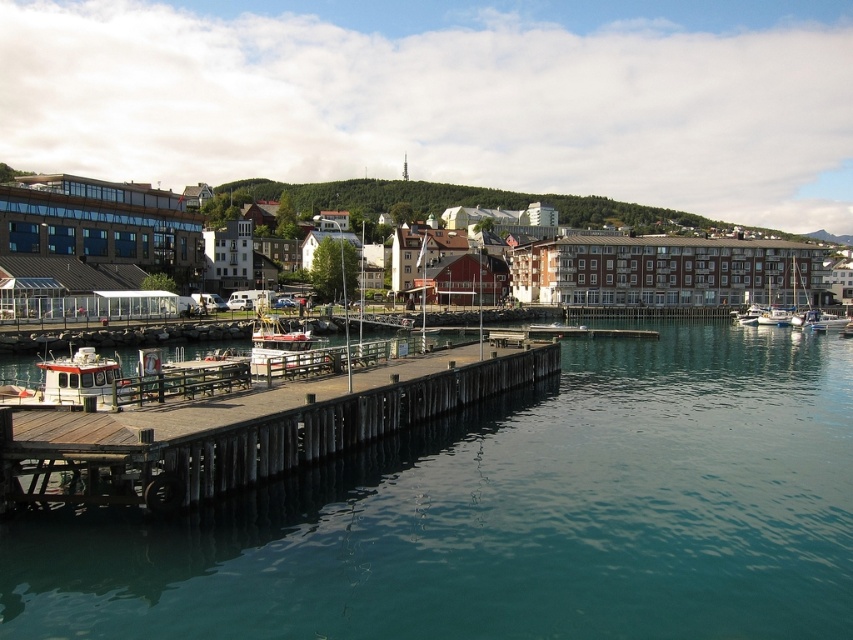
Does white matte boat at lower left appear on the left side of white wooden boat at center?

Indeed, white matte boat at lower left is positioned on the left side of white wooden boat at center.

Which of these two, white matte boat at lower left or white wooden boat at center, stands taller?

white wooden boat at center is taller.

Is point (68, 374) positioned before point (265, 332)?

Yes.

You are a GUI agent. You are given a task and a screenshot of the screen. Output one action in this format:
    pyautogui.click(x=<x>, y=<y>)
    Task: Click on the white matte boat at lower left
    This screenshot has height=640, width=853.
    Given the screenshot: What is the action you would take?
    pyautogui.click(x=71, y=381)

Does white wooden boat at center have a greater width compared to white plastic boat at lower right?

No, white wooden boat at center is not wider than white plastic boat at lower right.

Can you confirm if white wooden boat at center is positioned above white plastic boat at lower right?

No.

This screenshot has height=640, width=853. Find the location of `white wooden boat at center`. white wooden boat at center is located at coordinates (280, 348).

This screenshot has width=853, height=640. I want to click on white wooden boat at center, so tap(280, 348).

In the scene shown: Is wooden dock at center bigger than white plastic boat at lower right?

Indeed, wooden dock at center has a larger size compared to white plastic boat at lower right.

Who is lower down, wooden dock at center or white plastic boat at lower right?

Positioned lower is wooden dock at center.

Who is more forward, (447, 380) or (822, 312)?

Positioned in front is point (447, 380).

Where is `wooden dock at center`? This screenshot has width=853, height=640. wooden dock at center is located at coordinates (231, 440).